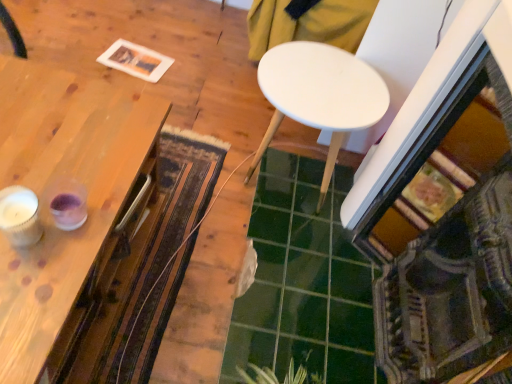
Find the location of a particular element. The height and width of the screenshot is (384, 512). free space that is in between textured woolen mat at center and green glossy tile at center is located at coordinates (215, 245).